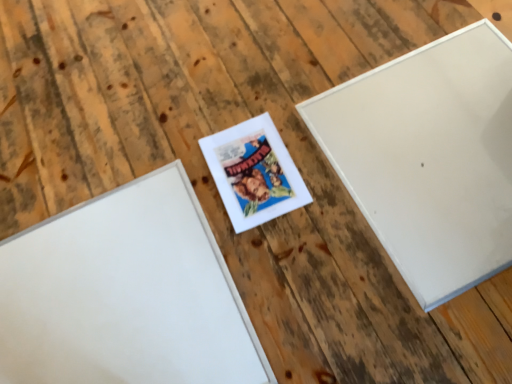
Looking at this image, what is the approximate height of white matte picture frame at upper right, the first picture frame positioned from the right?

The height of white matte picture frame at upper right, the first picture frame positioned from the right, is 0.41 inches.

What do you see at coordinates (254, 173) in the screenshot? The height and width of the screenshot is (384, 512). I see `matte white picture frame at center, the second picture frame from the left` at bounding box center [254, 173].

The height and width of the screenshot is (384, 512). In order to click on white matte picture frame at center, positioned as the 3th picture frame in right-to-left order in this screenshot , I will do `click(125, 294)`.

The height and width of the screenshot is (384, 512). Find the location of `white matte picture frame at upper right, placed as the third picture frame when sorted from left to right`. white matte picture frame at upper right, placed as the third picture frame when sorted from left to right is located at coordinates (430, 157).

Is white matte picture frame at center, positioned as the 3th picture frame in right-to-left order, wider or thinner than white matte picture frame at upper right, the first picture frame positioned from the right?

white matte picture frame at center, positioned as the 3th picture frame in right-to-left order, is thinner than white matte picture frame at upper right, the first picture frame positioned from the right.

Who is taller, white matte picture frame at center, positioned as the 3th picture frame in right-to-left order, or white matte picture frame at upper right, placed as the third picture frame when sorted from left to right?

white matte picture frame at upper right, placed as the third picture frame when sorted from left to right.

Is white matte picture frame at center, positioned as the 3th picture frame in right-to-left order, inside the boundaries of white matte picture frame at upper right, placed as the third picture frame when sorted from left to right, or outside?

white matte picture frame at center, positioned as the 3th picture frame in right-to-left order, is outside white matte picture frame at upper right, placed as the third picture frame when sorted from left to right.

Is point (435, 91) behind point (273, 183)?

Yes, it is.

Does white matte picture frame at upper right, the first picture frame positioned from the right, turn towards matte white picture frame at center, the second picture frame from the left?

No, white matte picture frame at upper right, the first picture frame positioned from the right, is not oriented towards matte white picture frame at center, the second picture frame from the left.

Based on the photo, how distant is white matte picture frame at upper right, the first picture frame positioned from the right, from matte white picture frame at center, the second picture frame from the left?

A distance of 11.73 inches exists between white matte picture frame at upper right, the first picture frame positioned from the right, and matte white picture frame at center, the second picture frame from the left.

From the image's perspective, does white matte picture frame at upper right, placed as the third picture frame when sorted from left to right, appear lower than matte white picture frame at center, the second picture frame from the left?

Incorrect, from the image's perspective, white matte picture frame at upper right, placed as the third picture frame when sorted from left to right, is higher than matte white picture frame at center, the second picture frame from the left.

Considering the relative positions of matte white picture frame at center, the second picture frame from the left, and white matte picture frame at center, positioned as the 3th picture frame in right-to-left order, in the image provided, is matte white picture frame at center, the second picture frame from the left, to the left of white matte picture frame at center, positioned as the 3th picture frame in right-to-left order, from the viewer's perspective?

No, matte white picture frame at center, the second picture frame from the left, is not to the left of white matte picture frame at center, positioned as the 3th picture frame in right-to-left order.

From the image's perspective, which one is positioned lower, matte white picture frame at center, the second picture frame from the left, or white matte picture frame at center, positioned as the 3th picture frame in right-to-left order?

white matte picture frame at center, positioned as the 3th picture frame in right-to-left order, from the image's perspective.

Could you tell me if matte white picture frame at center, the second picture frame from the left, is facing white matte picture frame at center, which appears as the 1th picture frame when viewed from the left?

No, matte white picture frame at center, the second picture frame from the left, is not oriented towards white matte picture frame at center, which appears as the 1th picture frame when viewed from the left.

Is matte white picture frame at center, the second picture frame from the left, closer to camera compared to white matte picture frame at center, positioned as the 3th picture frame in right-to-left order?

No, the depth of matte white picture frame at center, the second picture frame from the left, is greater than that of white matte picture frame at center, positioned as the 3th picture frame in right-to-left order.

Is white matte picture frame at center, positioned as the 3th picture frame in right-to-left order, oriented towards matte white picture frame at center, the second picture frame from the left?

No, white matte picture frame at center, positioned as the 3th picture frame in right-to-left order, is not oriented towards matte white picture frame at center, the second picture frame from the left.

Could you measure the distance between white matte picture frame at center, which appears as the 1th picture frame when viewed from the left, and matte white picture frame at center, positioned as the second picture frame in right-to-left order?

A distance of 28.16 centimeters exists between white matte picture frame at center, which appears as the 1th picture frame when viewed from the left, and matte white picture frame at center, positioned as the second picture frame in right-to-left order.

Between white matte picture frame at center, which appears as the 1th picture frame when viewed from the left, and matte white picture frame at center, the second picture frame from the left, which one has more height?

Standing taller between the two is matte white picture frame at center, the second picture frame from the left.

From the image's perspective, which object appears higher, white matte picture frame at upper right, the first picture frame positioned from the right, or white matte picture frame at center, which appears as the 1th picture frame when viewed from the left?

white matte picture frame at upper right, the first picture frame positioned from the right, from the image's perspective.

Based on the photo, is white matte picture frame at center, positioned as the 3th picture frame in right-to-left order, at the back of white matte picture frame at upper right, the first picture frame positioned from the right?

No, white matte picture frame at upper right, the first picture frame positioned from the right, is not facing away from white matte picture frame at center, positioned as the 3th picture frame in right-to-left order.

Considering the positions of objects white matte picture frame at upper right, the first picture frame positioned from the right, and white matte picture frame at center, which appears as the 1th picture frame when viewed from the left, in the image provided, who is more to the left, white matte picture frame at upper right, the first picture frame positioned from the right, or white matte picture frame at center, which appears as the 1th picture frame when viewed from the left,?

white matte picture frame at center, which appears as the 1th picture frame when viewed from the left.

Is white matte picture frame at upper right, the first picture frame positioned from the right, smaller than white matte picture frame at center, which appears as the 1th picture frame when viewed from the left?

No.

From a real-world perspective, is matte white picture frame at center, the second picture frame from the left, physically above white matte picture frame at upper right, placed as the third picture frame when sorted from left to right?

No.

Is matte white picture frame at center, the second picture frame from the left, aimed at white matte picture frame at upper right, the first picture frame positioned from the right?

No, matte white picture frame at center, the second picture frame from the left, does not turn towards white matte picture frame at upper right, the first picture frame positioned from the right.

Who is shorter, matte white picture frame at center, positioned as the second picture frame in right-to-left order, or white matte picture frame at upper right, the first picture frame positioned from the right?

matte white picture frame at center, positioned as the second picture frame in right-to-left order.

Where is `the 2nd picture frame below the white matte picture frame at upper right, the first picture frame positioned from the right (from the image's perspective)`? This screenshot has width=512, height=384. the 2nd picture frame below the white matte picture frame at upper right, the first picture frame positioned from the right (from the image's perspective) is located at coordinates (125, 294).

From a real-world perspective, starting from the matte white picture frame at center, the second picture frame from the left, which picture frame is the 2nd one vertically above it? Please provide its 2D coordinates.

[(430, 157)]

Estimate the real-world distances between objects in this image. Which object is closer to matte white picture frame at center, positioned as the second picture frame in right-to-left order, white matte picture frame at upper right, the first picture frame positioned from the right, or white matte picture frame at center, which appears as the 1th picture frame when viewed from the left?

A: white matte picture frame at center, which appears as the 1th picture frame when viewed from the left.

Considering their positions, is matte white picture frame at center, positioned as the second picture frame in right-to-left order, positioned further to white matte picture frame at center, positioned as the 3th picture frame in right-to-left order, than white matte picture frame at upper right, placed as the third picture frame when sorted from left to right?

white matte picture frame at upper right, placed as the third picture frame when sorted from left to right, is further to white matte picture frame at center, positioned as the 3th picture frame in right-to-left order.

Considering their positions, is white matte picture frame at center, which appears as the 1th picture frame when viewed from the left, positioned closer to white matte picture frame at upper right, placed as the third picture frame when sorted from left to right, than matte white picture frame at center, the second picture frame from the left?

matte white picture frame at center, the second picture frame from the left, is positioned closer to the anchor white matte picture frame at upper right, placed as the third picture frame when sorted from left to right.

Considering their positions, is white matte picture frame at upper right, placed as the third picture frame when sorted from left to right, positioned closer to white matte picture frame at center, positioned as the 3th picture frame in right-to-left order, than matte white picture frame at center, the second picture frame from the left?

The object closer to white matte picture frame at center, positioned as the 3th picture frame in right-to-left order, is matte white picture frame at center, the second picture frame from the left.

When comparing their distances from matte white picture frame at center, the second picture frame from the left, does white matte picture frame at center, positioned as the 3th picture frame in right-to-left order, or white matte picture frame at upper right, the first picture frame positioned from the right, seem further?

white matte picture frame at upper right, the first picture frame positioned from the right, is further to matte white picture frame at center, the second picture frame from the left.

Estimate the real-world distances between objects in this image. Which object is further from white matte picture frame at upper right, placed as the third picture frame when sorted from left to right, matte white picture frame at center, positioned as the second picture frame in right-to-left order, or white matte picture frame at center, positioned as the 3th picture frame in right-to-left order?

The object further to white matte picture frame at upper right, placed as the third picture frame when sorted from left to right, is white matte picture frame at center, positioned as the 3th picture frame in right-to-left order.

Identify the location of picture frame between white matte picture frame at center, positioned as the 3th picture frame in right-to-left order, and white matte picture frame at upper right, placed as the third picture frame when sorted from left to right, in the horizontal direction. The width and height of the screenshot is (512, 384). (254, 173).